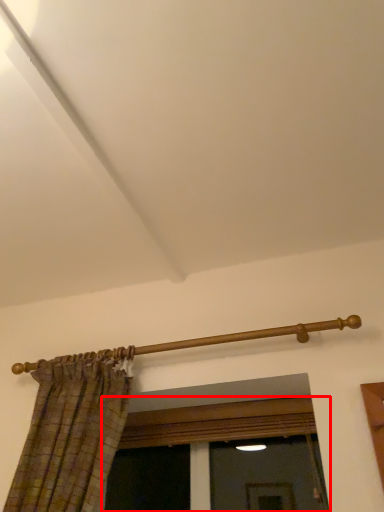
Question: From the image's perspective, considering the relative positions of window (annotated by the red box) and rail in the image provided, where is window (annotated by the red box) located with respect to the staircase?

Choices:
 (A) below
 (B) above

Answer: (A)